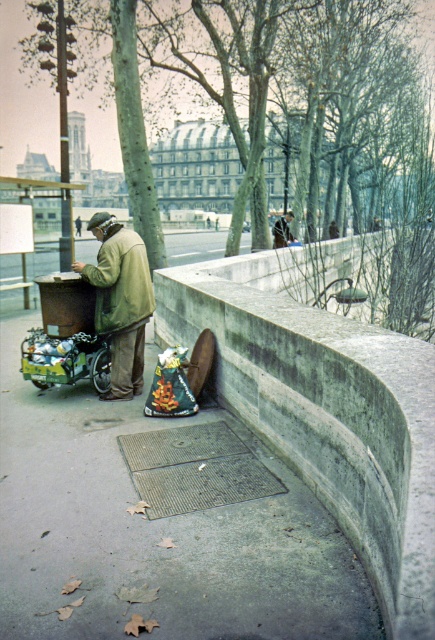
Question: Based on their relative distances, which object is farther from the concrete ledge at lower center?

Choices:
 (A) matte brown coat at left
 (B) concrete pavement at lower left

Answer: (B)

Question: Is concrete pavement at lower left thinner than light brown leather jacket at upper center?

Choices:
 (A) yes
 (B) no

Answer: (B)

Question: Is concrete ledge at lower center to the left of light brown leather jacket at upper center from the viewer's perspective?

Choices:
 (A) no
 (B) yes

Answer: (B)

Question: Is matte brown coat at left closer to camera compared to light brown leather jacket at upper center?

Choices:
 (A) no
 (B) yes

Answer: (B)

Question: Which is nearer to the concrete ledge at lower center?

Choices:
 (A) light brown leather jacket at upper center
 (B) matte brown coat at left
 (C) concrete pavement at lower left

Answer: (B)

Question: Which object appears closest to the camera in this image?

Choices:
 (A) matte brown coat at left
 (B) concrete ledge at lower center
 (C) concrete pavement at lower left
 (D) light brown leather jacket at upper center

Answer: (B)